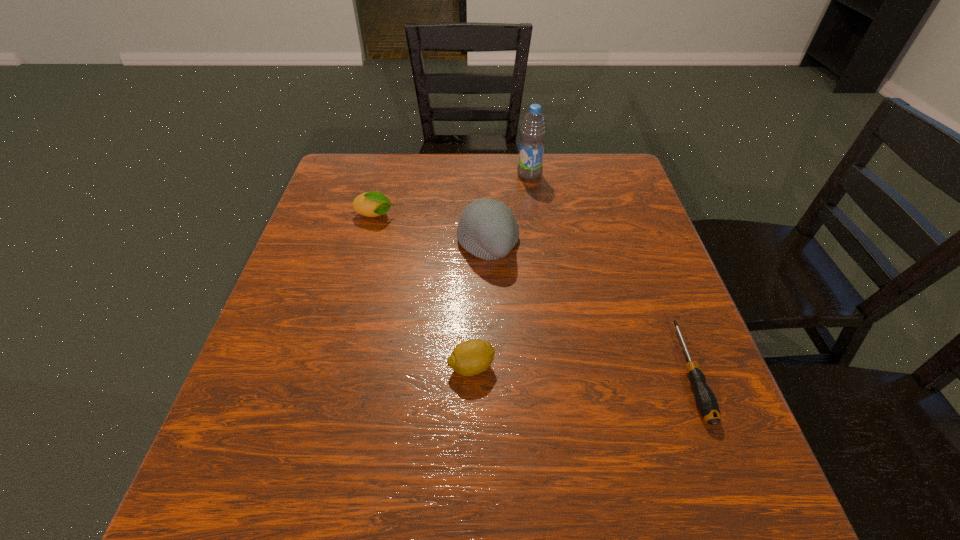
Where is `free spot that satisfies the following two spatial constraints: 1. with leaves positioned above the screwdriver; 2. on the right side of the leftmost object`? This screenshot has width=960, height=540. free spot that satisfies the following two spatial constraints: 1. with leaves positioned above the screwdriver; 2. on the right side of the leftmost object is located at coordinates (x=333, y=372).